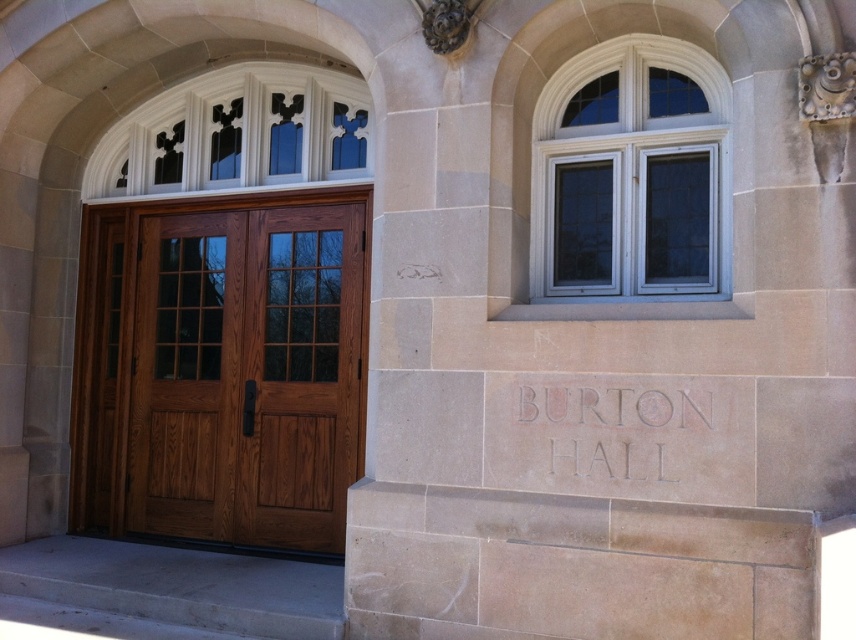
Does mahogany wood door at center have a smaller size compared to carved stone text at center?

No.

Can you confirm if mahogany wood door at center is positioned to the right of carved stone text at center?

Incorrect, mahogany wood door at center is not on the right side of carved stone text at center.

At what (x,y) coordinates should I click in order to perform the action: click on mahogany wood door at center. Please return your answer as a coordinate pair (x, y). Image resolution: width=856 pixels, height=640 pixels. Looking at the image, I should click on [221, 371].

Can you confirm if beige stone pillar at center is smaller than mahogany wood door at center?

No.

Between beige stone pillar at center and mahogany wood door at center, which one has more height?

beige stone pillar at center is taller.

I want to click on beige stone pillar at center, so click(604, 317).

At what (x,y) coordinates should I click in order to perform the action: click on beige stone pillar at center. Please return your answer as a coordinate pair (x, y). Looking at the image, I should click on (604, 317).

What do you see at coordinates (604, 317) in the screenshot? This screenshot has height=640, width=856. I see `beige stone pillar at center` at bounding box center [604, 317].

Does point (584, 467) lie behind point (648, 420)?

That is True.

Who is more forward, (545, 227) or (620, 435)?

Positioned in front is point (620, 435).

Locate an element on the screen. beige stone pillar at center is located at coordinates (604, 317).